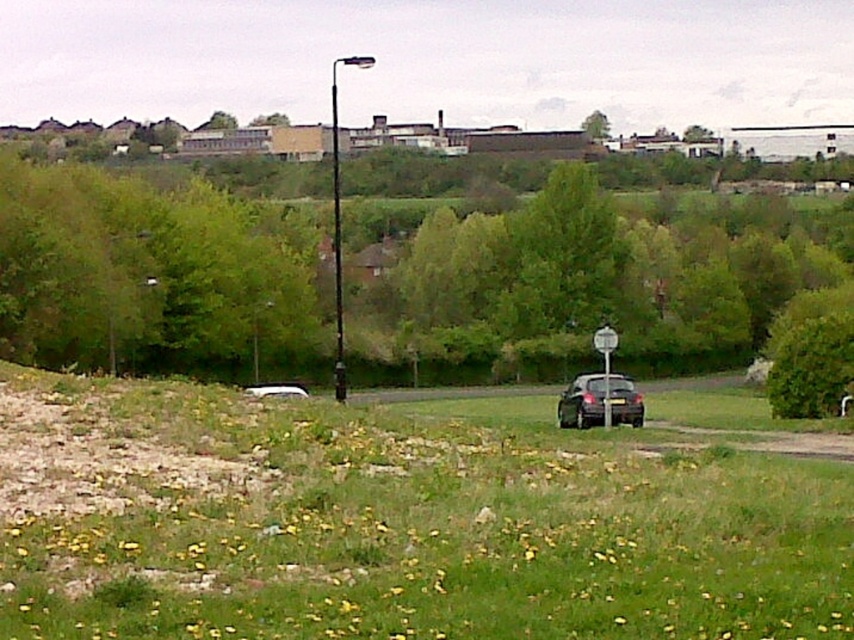
Question: Among these points, which one is farthest from the camera?

Choices:
 (A) (557, 417)
 (B) (527, 301)

Answer: (B)

Question: Which of the following is the closest to the observer?

Choices:
 (A) (127, 620)
 (B) (594, 140)
 (C) (151, 284)
 (D) (607, 365)

Answer: (A)

Question: Does green grassy field at center have a smaller size compared to metallic silver street sign at center?

Choices:
 (A) yes
 (B) no

Answer: (B)

Question: Does green grassy field at center appear over green leafy tree at center?

Choices:
 (A) no
 (B) yes

Answer: (A)

Question: Can you confirm if green grassy field at center is positioned below metallic silver street sign at center?

Choices:
 (A) yes
 (B) no

Answer: (A)

Question: Which of the following is the closest to the observer?

Choices:
 (A) metallic silver street sign at center
 (B) green leafy tree at center
 (C) green leafy tree at upper center

Answer: (A)